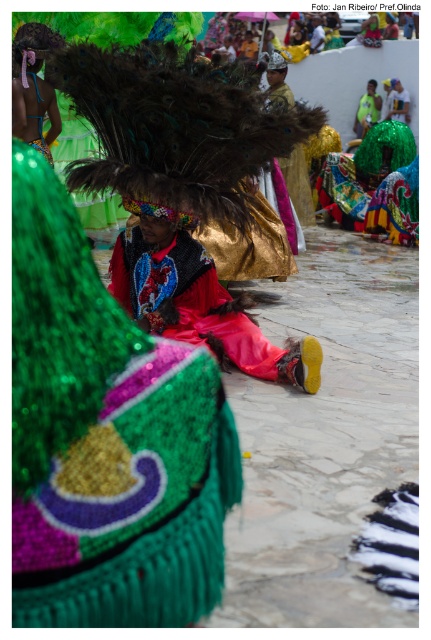
Which is more to the left, shiny sequined skirt at center or shiny sequined costume at center?

From the viewer's perspective, shiny sequined skirt at center appears more on the left side.

Does point (152, 451) lie in front of point (215, 355)?

That is True.

The height and width of the screenshot is (640, 431). In order to click on shiny sequined skirt at center in this screenshot , I will do `click(106, 440)`.

Who is higher up, shiny sequined headdress at upper left or shiny metallic mask at upper left?

shiny sequined headdress at upper left is above.

Between shiny sequined headdress at upper left and shiny metallic mask at upper left, which one has less height?

shiny metallic mask at upper left

Between point (25, 61) and point (38, 100), which one is positioned in front?

Point (25, 61)

Locate an element on the screen. This screenshot has height=640, width=431. shiny sequined headdress at upper left is located at coordinates (34, 86).

Does shiny sequined skirt at center have a lesser height compared to shiny metallic mask at upper left?

No, shiny sequined skirt at center is not shorter than shiny metallic mask at upper left.

Image resolution: width=431 pixels, height=640 pixels. Describe the element at coordinates (106, 440) in the screenshot. I see `shiny sequined skirt at center` at that location.

Where is `shiny sequined skirt at center`? shiny sequined skirt at center is located at coordinates (106, 440).